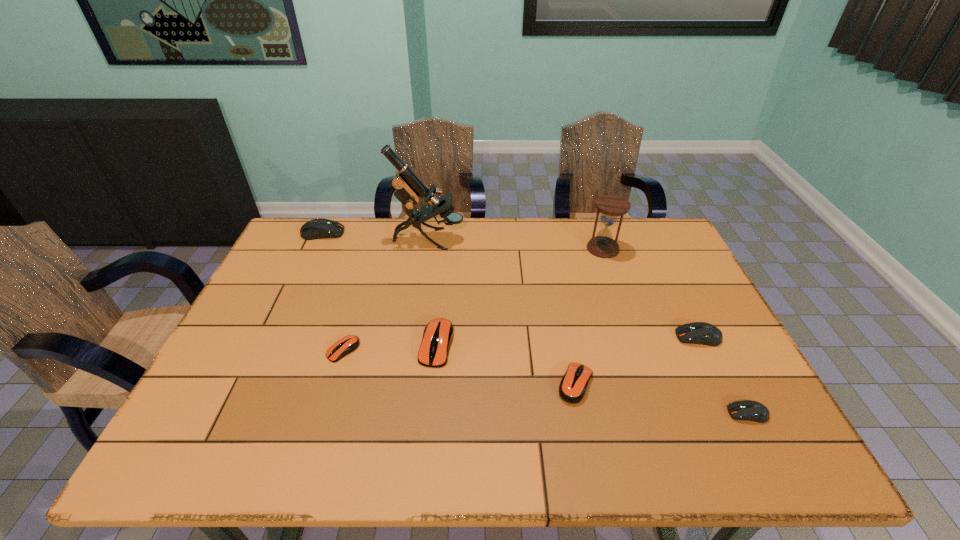
In order to click on the nearest dark computer equipment in this screenshot , I will do `click(747, 410)`.

Identify the location of the leftmost orange computer mouse. (346, 345).

Where is `the second computer mouse from left to right`? This screenshot has width=960, height=540. the second computer mouse from left to right is located at coordinates (346, 345).

Image resolution: width=960 pixels, height=540 pixels. Identify the location of vacant area located through the eyepiece of the tallest object. (523, 239).

Find the location of a particular element. vacant area located 0.130m on the left of the third object from right to left is located at coordinates (547, 248).

Image resolution: width=960 pixels, height=540 pixels. I want to click on free location located on the button of the farthest dark computer equipment, so click(x=452, y=233).

You are a GUI agent. You are given a task and a screenshot of the screen. Output one action in this format:
    pyautogui.click(x=<x>, y=<y>)
    Task: Click on the free space located 0.370m on the back of the third computer mouse from left to right
    
    Given the screenshot: What is the action you would take?
    pyautogui.click(x=446, y=242)

I want to click on vacant point located 0.210m on the button of the second nearest dark computer equipment, so click(596, 337).

Locate an element on the screen. Image resolution: width=960 pixels, height=540 pixels. vacant space located 0.060m on the button of the second nearest dark computer equipment is located at coordinates (653, 337).

This screenshot has width=960, height=540. In order to click on vacant region located 0.140m on the button of the second nearest dark computer equipment in this screenshot , I will do `click(623, 337)`.